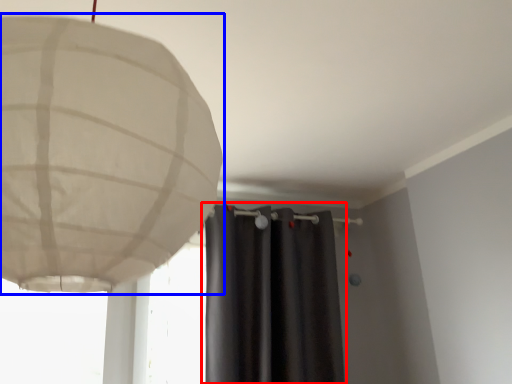
Question: Which of the following is the closest to the observer, curtain (highlighted by a red box) or lamp (highlighted by a blue box)?

Choices:
 (A) curtain
 (B) lamp

Answer: (B)